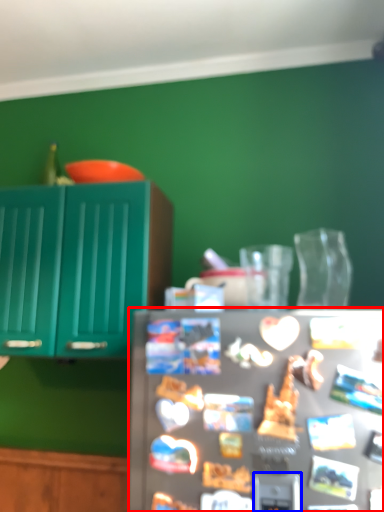
Question: Which point is further to the camera, refrigerator (highlighted by a red box) or appliance (highlighted by a blue box)?

Choices:
 (A) refrigerator
 (B) appliance

Answer: (B)